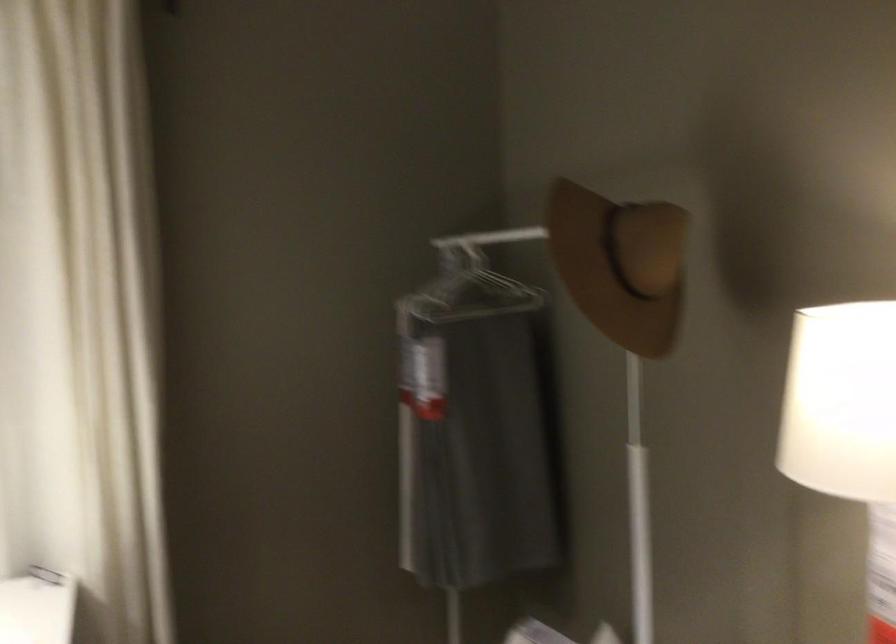
Which object does [470,281] point to?

It refers to a clothes hanger.